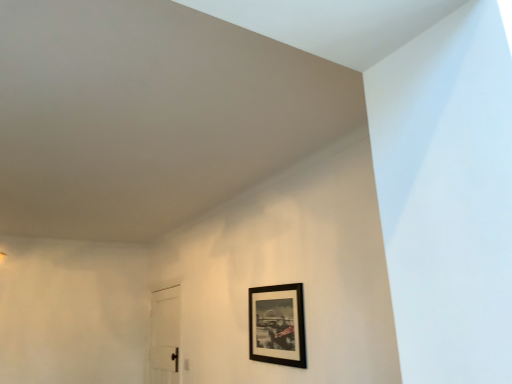
What do you see at coordinates (277, 325) in the screenshot?
I see `black matte picture frame at upper right` at bounding box center [277, 325].

Identify the location of black matte picture frame at upper right. This screenshot has height=384, width=512. (277, 325).

Find the location of `black matte picture frame at upper right`. black matte picture frame at upper right is located at coordinates (277, 325).